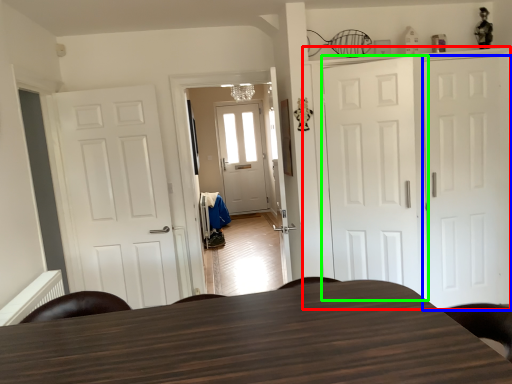
Question: Estimate the real-world distances between objects in this image. Which object is farther from cabinetry (highlighted by a red box), door (highlighted by a blue box) or door (highlighted by a green box)?

Choices:
 (A) door
 (B) door

Answer: (A)